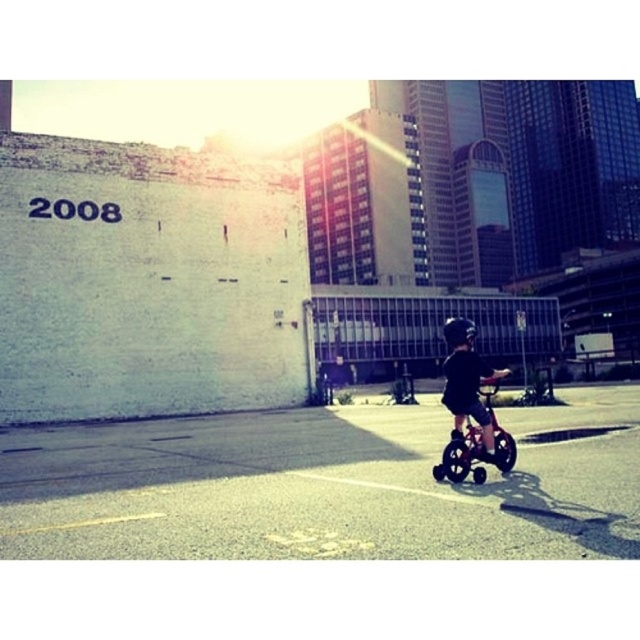
Who is positioned more to the left, black matte helmet at center or black matte bicycle at center?

Positioned to the left is black matte bicycle at center.

Can you confirm if black matte helmet at center is taller than black matte bicycle at center?

Yes.

Describe the element at coordinates (467, 380) in the screenshot. Image resolution: width=640 pixels, height=640 pixels. I see `black matte helmet at center` at that location.

Find the location of a particular element. Image resolution: width=640 pixels, height=640 pixels. black matte helmet at center is located at coordinates (467, 380).